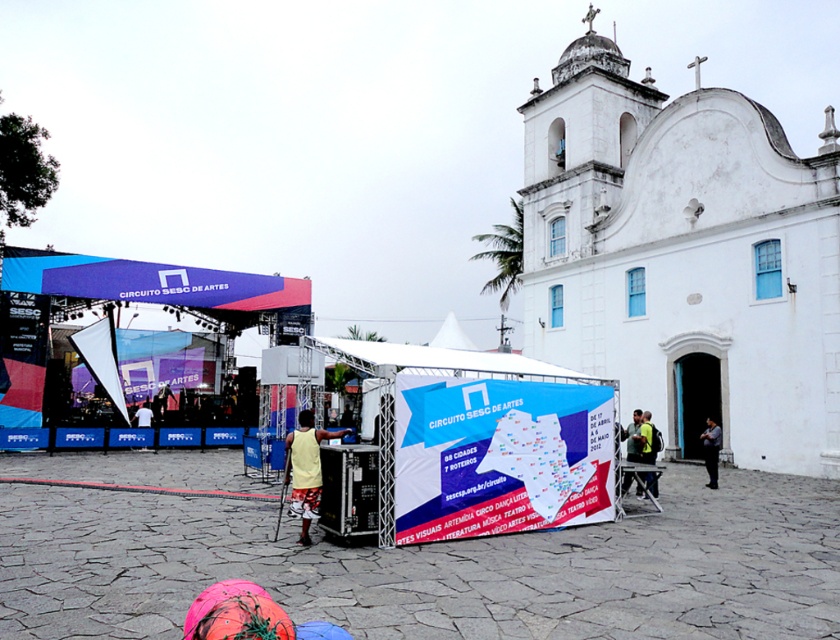
Who is higher up, matte blue banner at center or dark gray fabric shirt at center?

matte blue banner at center is above.

Is point (142, 264) closer to camera compared to point (715, 448)?

No, it is behind (715, 448).

At what (x,y) coordinates should I click in order to perform the action: click on matte blue banner at center. Please return your answer as a coordinate pair (x, y). The height and width of the screenshot is (640, 840). Looking at the image, I should click on (148, 282).

Is matte blue banner at center smaller than yellow-green fabric jacket at center-right?

No, matte blue banner at center is not smaller than yellow-green fabric jacket at center-right.

Who is positioned more to the right, matte blue banner at center or yellow-green fabric jacket at center-right?

yellow-green fabric jacket at center-right

Find the location of a particular element. matte blue banner at center is located at coordinates (148, 282).

Who is lower down, white stone church at center or green fabric bag at center?

green fabric bag at center is lower down.

Between point (786, 170) and point (636, 456), which one is positioned in front?

Point (636, 456)

Where is `white stone church at center`? Image resolution: width=840 pixels, height=640 pixels. white stone church at center is located at coordinates (685, 257).